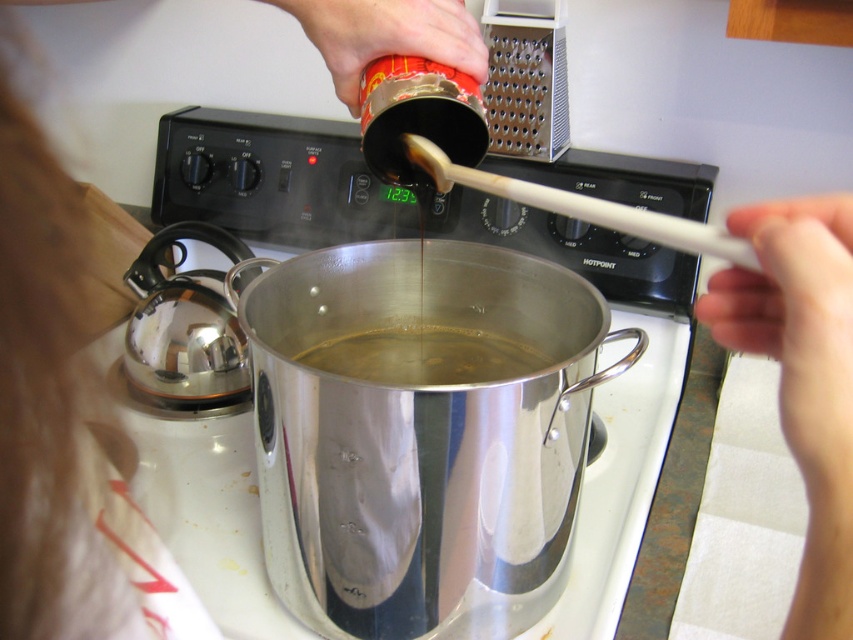
Is white plastic spoon at upper right bigger than wooden spoon at upper center?

Indeed, white plastic spoon at upper right has a larger size compared to wooden spoon at upper center.

Which is in front, point (698, 317) or point (480, 49)?

Positioned in front is point (698, 317).

At what (x,y) coordinates should I click in order to perform the action: click on white plastic spoon at upper right. Please return your answer as a coordinate pair (x, y). The height and width of the screenshot is (640, 853). Looking at the image, I should click on (802, 376).

Which is above, wooden spoon at upper center or translucent liquid at center?

wooden spoon at upper center is higher up.

Measure the distance between wooden spoon at upper center and camera.

The distance of wooden spoon at upper center from camera is 20.30 inches.

Does point (363, 58) come farther from viewer compared to point (355, 355)?

That is False.

Locate an element on the screen. This screenshot has width=853, height=640. wooden spoon at upper center is located at coordinates (386, 35).

Identify the location of white plastic spoon at upper right. This screenshot has width=853, height=640. (802, 376).

Does point (740, 332) come behind point (360, 365)?

No, it is not.

Is point (827, 436) positioned in front of point (477, 356)?

That is True.

In order to click on white plastic spoon at upper right in this screenshot , I will do point(802,376).